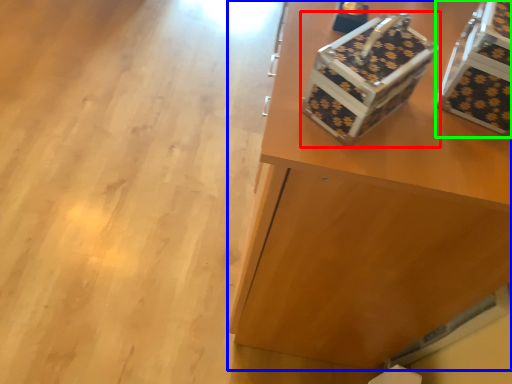
Question: Which object is the closest to the shoe box (highlighted by a red box)? Choose among these: furniture (highlighted by a blue box) or storage box (highlighted by a green box).

Choices:
 (A) furniture
 (B) storage box

Answer: (B)